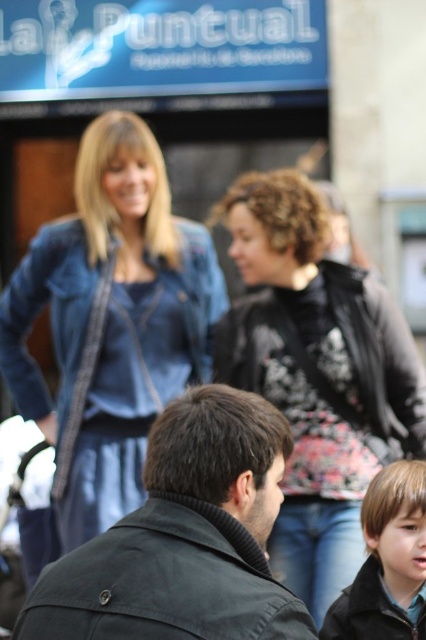
Can you confirm if denim jacket at upper center is positioned below dark green jacket at center?

No.

Consider the image. Who is more forward, (80, 144) or (279, 417)?

Point (279, 417) is more forward.

Identify the location of denim jacket at upper center. (109, 324).

Does dark green jacket at center have a lesser height compared to black matte jacket at lower right?

Incorrect, dark green jacket at center's height does not fall short of black matte jacket at lower right's.

Is dark green jacket at center taller than black matte jacket at lower right?

Correct, dark green jacket at center is much taller as black matte jacket at lower right.

At what (x,y) coordinates should I click in order to perform the action: click on dark green jacket at center. Please return your answer as a coordinate pair (x, y). Looking at the image, I should click on (184, 538).

Is floral-patterned fabric at center closer to the viewer compared to dark green jacket at center?

No, it is behind dark green jacket at center.

Does floral-patterned fabric at center come behind dark green jacket at center?

Yes, floral-patterned fabric at center is further from the viewer.

Is point (359, 561) more distant than point (134, 554)?

Yes.

Find the location of `floral-patterned fabric at center`. floral-patterned fabric at center is located at coordinates (316, 374).